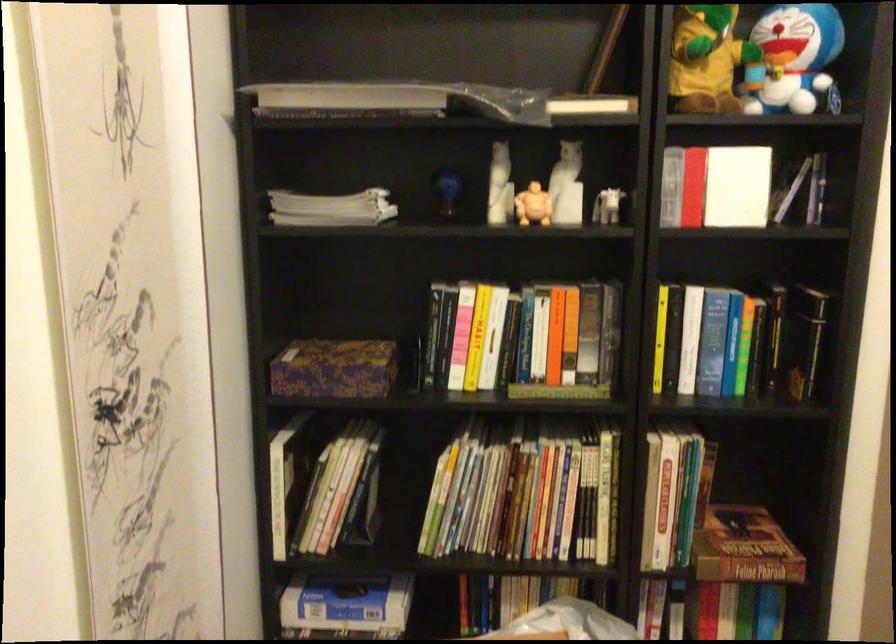
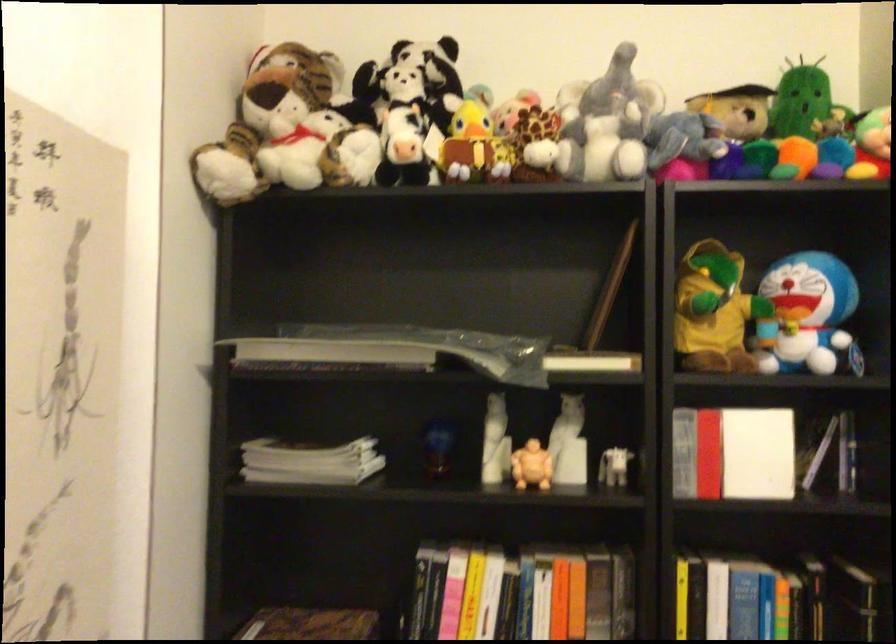
The point at (535, 204) is marked in the first image. Where is the corresponding point in the second image?

(531, 466)